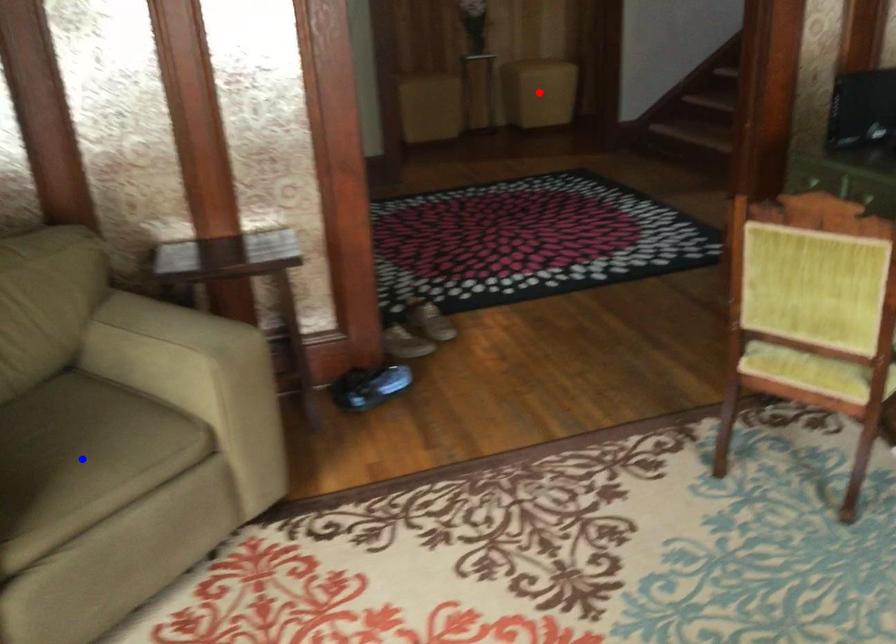
Question: In the image, two points are highlighted. Which point is nearer to the camera? Reply with the corresponding letter.

Choices:
 (A) blue point
 (B) red point

Answer: (A)